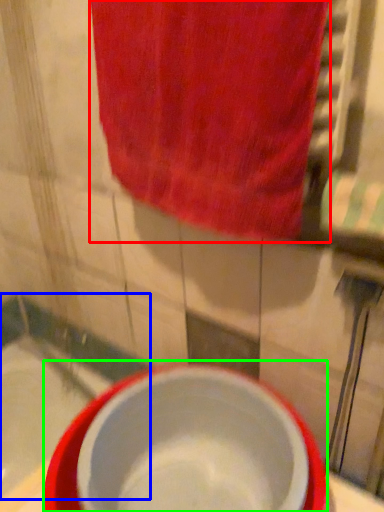
Question: Based on their relative distances, which object is farther from towel (highlighted by a red box)? Choose from bath (highlighted by a blue box) and basin (highlighted by a green box).

Choices:
 (A) bath
 (B) basin

Answer: (A)